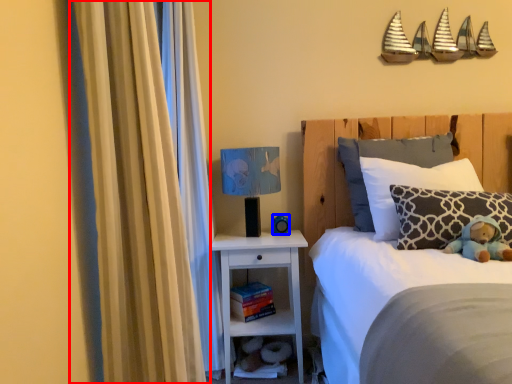
Question: Which point is closer to the camera, curtain (highlighted by a red box) or toy (highlighted by a blue box)?

Choices:
 (A) curtain
 (B) toy

Answer: (A)